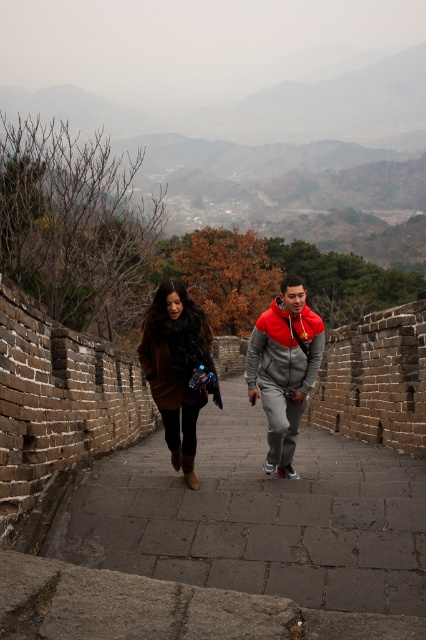
Can you confirm if brown woolen coat at center is taller than red-gray hoodie at center?

Yes.

Which of these two, brown woolen coat at center or red-gray hoodie at center, stands shorter?

red-gray hoodie at center is shorter.

Is point (186, 465) positioned after point (284, 355)?

No, (186, 465) is in front of (284, 355).

Find the location of a particular element. brown woolen coat at center is located at coordinates (176, 368).

Can you confirm if red-gray hoodie at center is bigger than brown fuzzy coat at center?

Incorrect, red-gray hoodie at center is not larger than brown fuzzy coat at center.

This screenshot has width=426, height=640. What do you see at coordinates (284, 369) in the screenshot? I see `red-gray hoodie at center` at bounding box center [284, 369].

Between point (293, 288) and point (141, 355), which one is positioned in front?

Positioned in front is point (293, 288).

Find the location of `red-gray hoodie at center`. red-gray hoodie at center is located at coordinates [284, 369].

Is brick stone path at center thinner than gray fleece sweatshirt at center?

No, brick stone path at center is not thinner than gray fleece sweatshirt at center.

Can you confirm if brick stone path at center is taller than gray fleece sweatshirt at center?

In fact, brick stone path at center may be shorter than gray fleece sweatshirt at center.

Image resolution: width=426 pixels, height=640 pixels. What are the coordinates of `brick stone path at center` in the screenshot? It's located at (256, 515).

Locate an element on the screen. The image size is (426, 640). brick stone path at center is located at coordinates (256, 515).